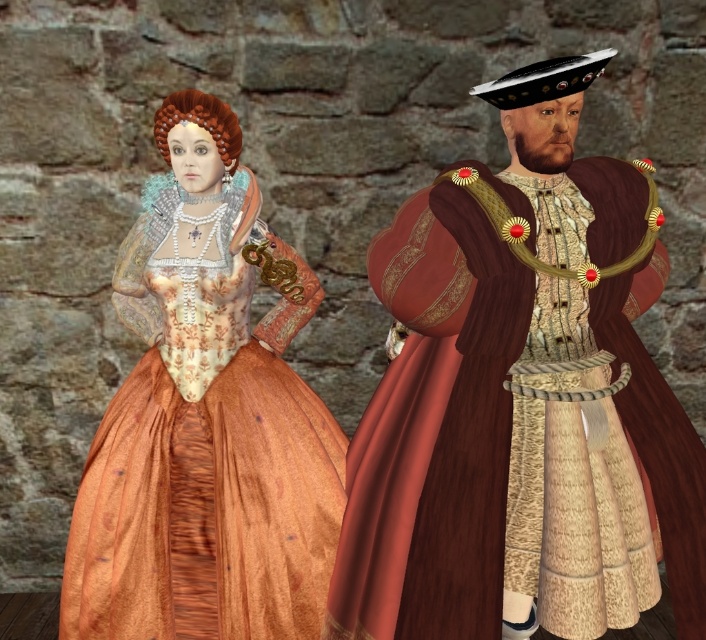
Question: From the image, what is the correct spatial relationship of velvet gold brocade robe at right in relation to matte gold dress at center?

Choices:
 (A) left
 (B) right

Answer: (B)

Question: Which point is farther to the camera?

Choices:
 (A) (232, 422)
 (B) (592, 582)

Answer: (A)

Question: Among these points, which one is nearest to the camera?

Choices:
 (A) (654, 497)
 (B) (244, 300)

Answer: (A)

Question: Can you confirm if velvet gold brocade robe at right is wider than matte gold dress at center?

Choices:
 (A) yes
 (B) no

Answer: (A)

Question: Does velvet gold brocade robe at right appear on the left side of matte gold dress at center?

Choices:
 (A) no
 (B) yes

Answer: (A)